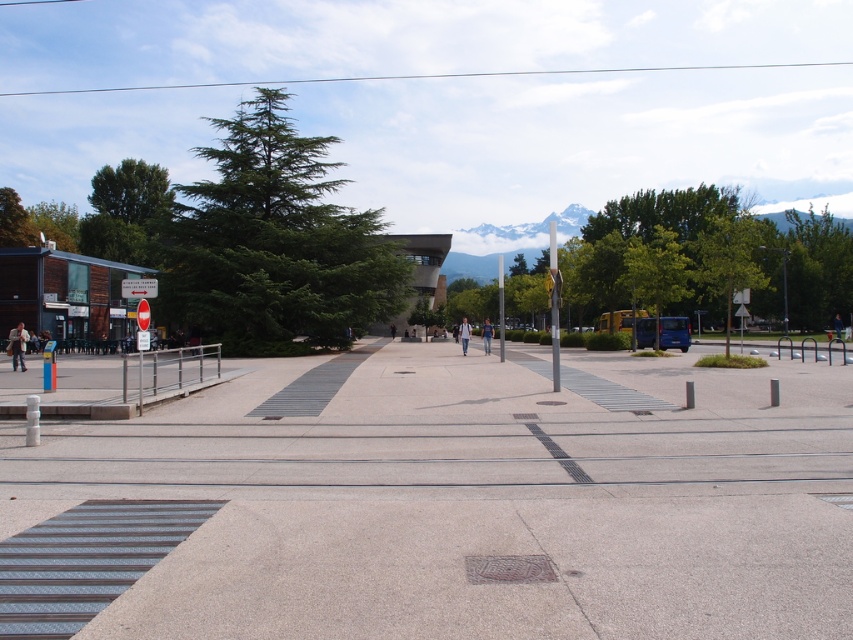
Question: Which object is farther from the camera taking this photo?

Choices:
 (A) light blue jeans at center
 (B) light brown leather jacket at left

Answer: (A)

Question: Which object is the farthest from the gray concrete pavement at center?

Choices:
 (A) denim jeans at center
 (B) light blue jeans at center
 (C) light brown leather jacket at left

Answer: (A)

Question: Is gray concrete pavement at center positioned at the back of denim jeans at center?

Choices:
 (A) no
 (B) yes

Answer: (A)

Question: Is denim jeans at center to the right of light blue jeans at center from the viewer's perspective?

Choices:
 (A) yes
 (B) no

Answer: (A)

Question: Does denim jeans at center have a smaller size compared to light blue jeans at center?

Choices:
 (A) no
 (B) yes

Answer: (A)

Question: Which point is farther to the camera?

Choices:
 (A) gray concrete pavement at center
 (B) light blue jeans at center
 (C) light brown leather jacket at left

Answer: (B)